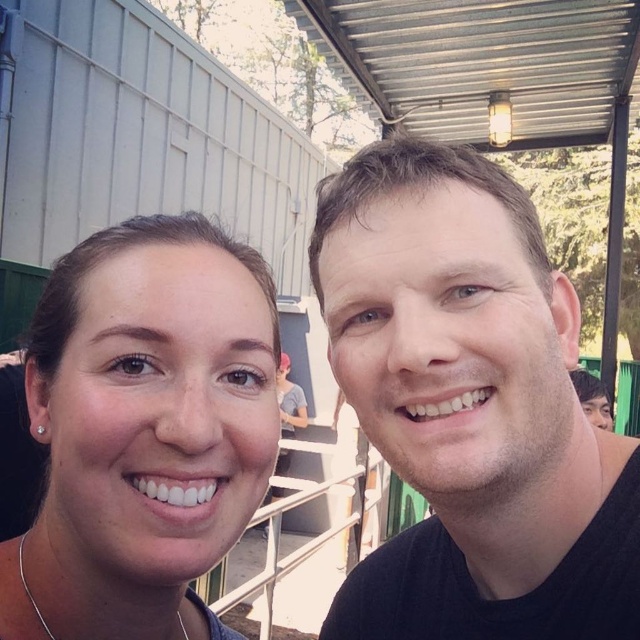
From the picture: Who is taller, matte skin at center or silver chain at lower left?

matte skin at center is taller.

Is matte skin at center thinner than silver chain at lower left?

In fact, matte skin at center might be wider than silver chain at lower left.

Between point (132, 445) and point (22, 577), which one is positioned behind?

The point (22, 577) is more distant.

You are a GUI agent. You are given a task and a screenshot of the screen. Output one action in this format:
    pyautogui.click(x=<x>, y=<y>)
    Task: Click on the matte skin at center
    The width and height of the screenshot is (640, 640).
    Given the screenshot: What is the action you would take?
    pyautogui.click(x=144, y=429)

Does point (563, 371) come farther from viewer compared to point (198, 525)?

Yes, point (563, 371) is behind point (198, 525).

Looking at this image, which is below, black matte shirt at right or matte skin at center?

black matte shirt at right is lower down.

Who is more forward, (499, 390) or (116, 468)?

Point (116, 468) is more forward.

At what (x,y) coordinates should I click in order to perform the action: click on black matte shirt at right. Please return your answer as a coordinate pair (x, y). This screenshot has height=640, width=640. Looking at the image, I should click on (468, 406).

How far apart are black matte shirt at right and silver chain at lower left?

black matte shirt at right and silver chain at lower left are 14.09 inches apart from each other.

Is black matte shirt at right taller than silver chain at lower left?

Yes.

What do you see at coordinates (468, 406) in the screenshot? I see `black matte shirt at right` at bounding box center [468, 406].

At what (x,y) coordinates should I click in order to perform the action: click on black matte shirt at right. Please return your answer as a coordinate pair (x, y). The height and width of the screenshot is (640, 640). Looking at the image, I should click on (468, 406).